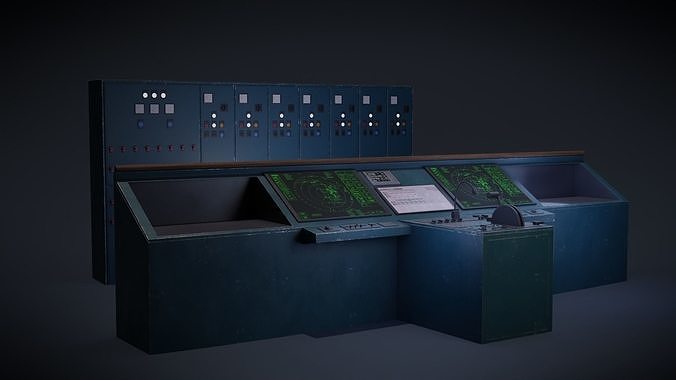
The width and height of the screenshot is (676, 380). Identify the location of left side of desk. (110, 235).